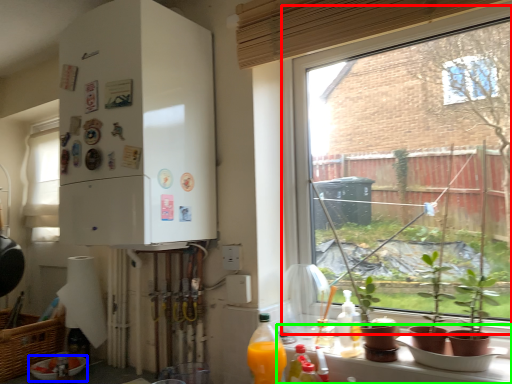
Question: Which object is positioned farthest from window (highlighted by a red box)? Select from bowl (highlighted by a blue box) and window sill (highlighted by a green box).

Choices:
 (A) bowl
 (B) window sill

Answer: (A)